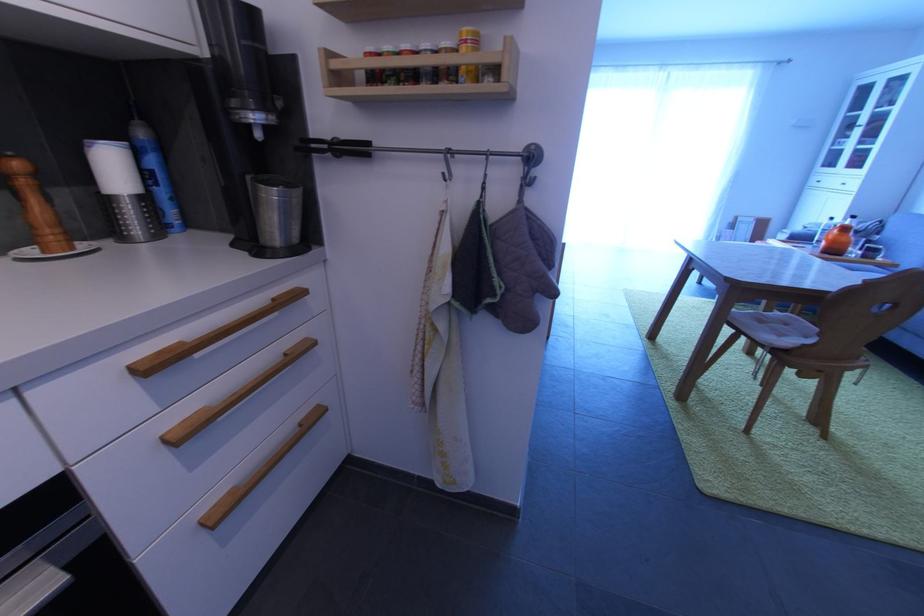
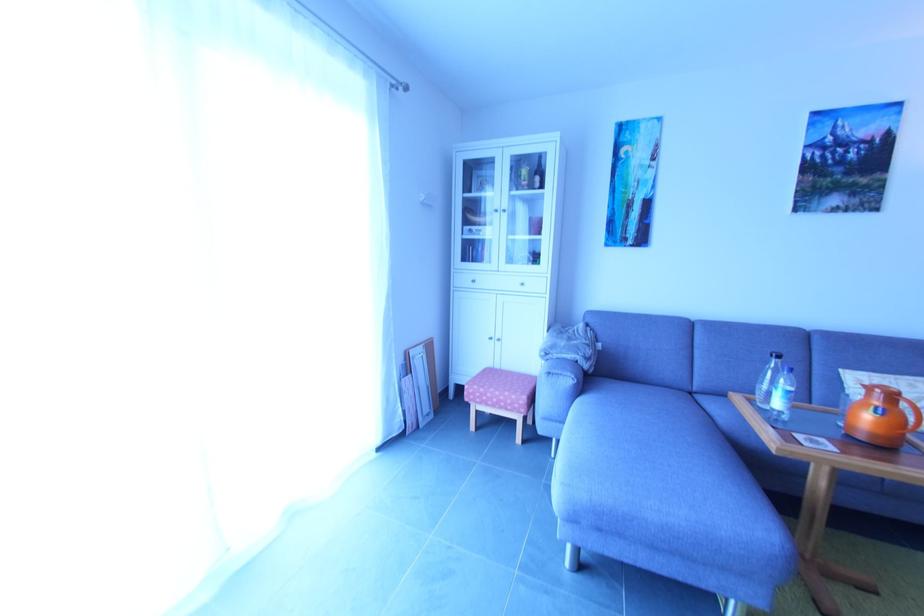
In the second image, find the point that corresponds to pixel 735 223 in the first image.

(406, 362)